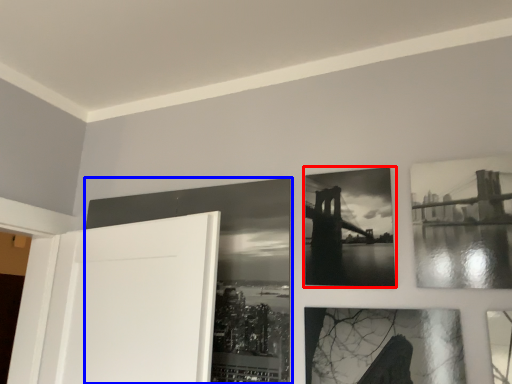
Question: Among these objects, which one is nearest to the camera, picture frame (highlighted by a red box) or picture frame (highlighted by a blue box)?

Choices:
 (A) picture frame
 (B) picture frame

Answer: (A)